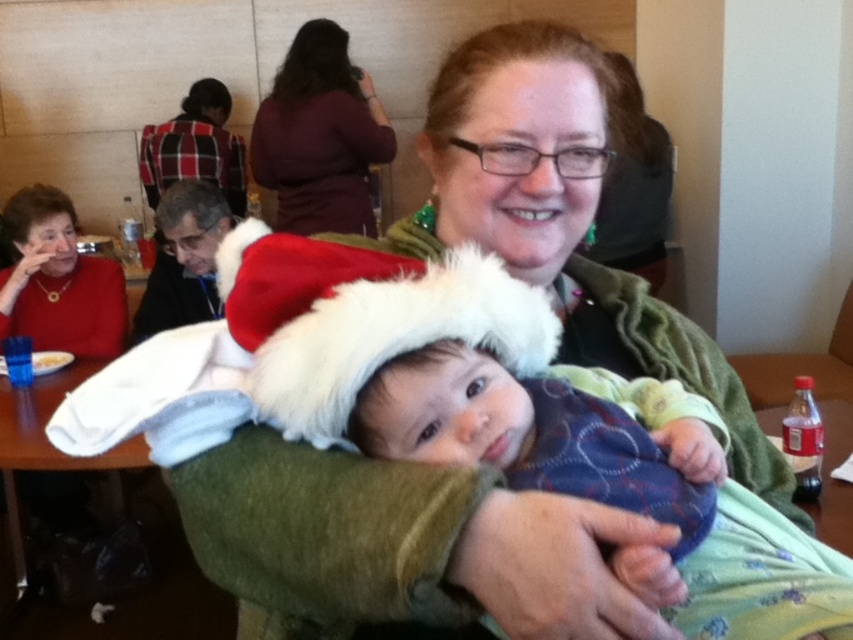
Between matte red sweater at left and wooden table at lower left, which one is positioned higher?

matte red sweater at left is above.

Which is in front, point (35, 225) or point (49, 376)?

Point (49, 376) is in front.

You are a GUI agent. You are given a task and a screenshot of the screen. Output one action in this format:
    pyautogui.click(x=<x>, y=<y>)
    Task: Click on the matte red sweater at left
    This screenshot has width=853, height=640.
    Given the screenshot: What is the action you would take?
    pyautogui.click(x=57, y=280)

Is point (527, 353) behind point (376, 112)?

No, it is not.

Between white fluffy santa hat at center and maroon sweater at upper center, which one is positioned higher?

maroon sweater at upper center is above.

Between point (300, 308) and point (264, 150), which one is positioned behind?

The point (264, 150) is more distant.

Where is `white fluffy santa hat at center`? Image resolution: width=853 pixels, height=640 pixels. white fluffy santa hat at center is located at coordinates (363, 321).

In the scene shown: Who is more distant from viewer, (105, 468) or (219, 147)?

The point (219, 147) is more distant.

Where is `wooden table at lower left`? Image resolution: width=853 pixels, height=640 pixels. wooden table at lower left is located at coordinates (51, 448).

Where is `wooden table at lower left`? The image size is (853, 640). wooden table at lower left is located at coordinates (51, 448).